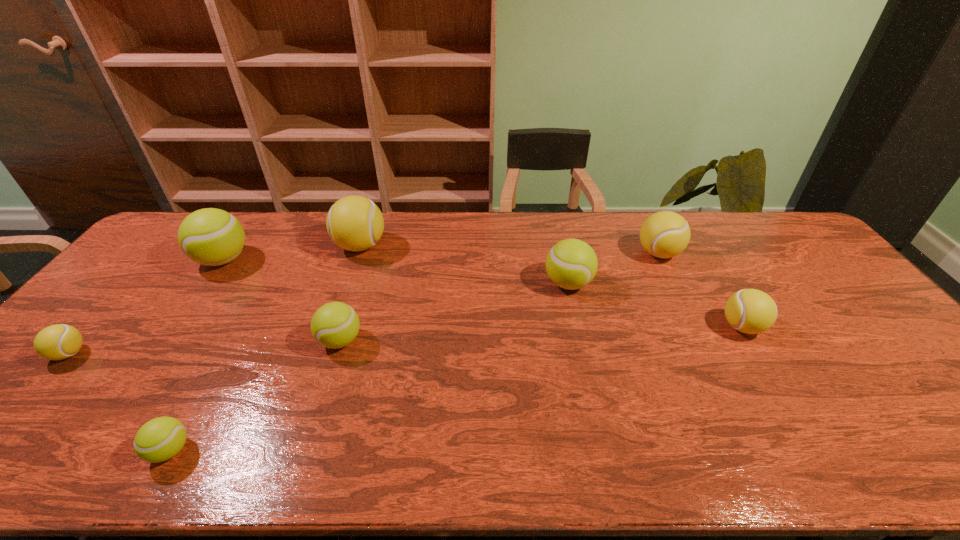
This screenshot has width=960, height=540. Find the location of `free space located on the left of the third tennis ball from left to right`. free space located on the left of the third tennis ball from left to right is located at coordinates (9, 450).

You are a GUI agent. You are given a task and a screenshot of the screen. Output one action in this format:
    pyautogui.click(x=<x>, y=<y>)
    Task: Click on the object at the near edge
    The width and height of the screenshot is (960, 540).
    Given the screenshot: What is the action you would take?
    pyautogui.click(x=160, y=439)

Where is `object at the left edge`? This screenshot has width=960, height=540. object at the left edge is located at coordinates (60, 341).

Find the location of a particular element. vacant point at the far edge is located at coordinates (309, 218).

In the image, there is a desktop. Identify the location of vacant space at the near edge. (98, 441).

This screenshot has width=960, height=540. Identify the location of free space at the right edge of the desktop. (807, 290).

The height and width of the screenshot is (540, 960). What are the coordinates of `vacant space at the far left corner of the desktop` in the screenshot? It's located at (177, 222).

Find the location of a particular element. vacant space in between the sixth object from right to left and the leftmost green tennis ball is located at coordinates (197, 355).

Locate an element on the screen. The width and height of the screenshot is (960, 540). free space between the sixth tennis ball from left to right and the nearest green tennis ball is located at coordinates (370, 367).

Find the location of a particular element. vacant area that lies between the second tennis ball from left to right and the smallest yellow tennis ball is located at coordinates 146,307.